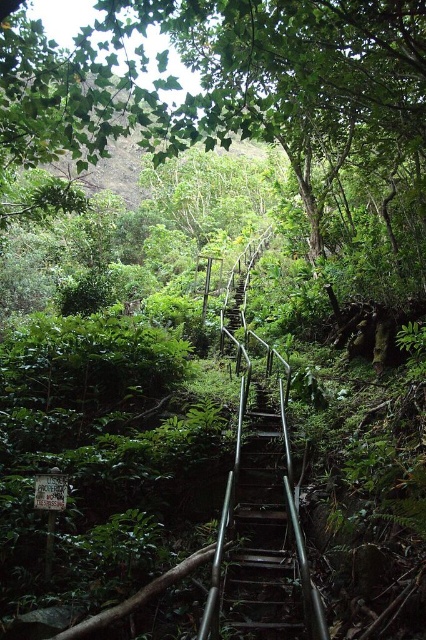
Between green leafy tree at upper center and metallic silver stairs at center, which one has less height?

metallic silver stairs at center

Is green leafy tree at upper center shorter than metallic silver stairs at center?

In fact, green leafy tree at upper center may be taller than metallic silver stairs at center.

Is point (412, 97) closer to viewer compared to point (255, 564)?

No, it is behind (255, 564).

This screenshot has width=426, height=640. Find the location of `green leafy tree at upper center`. green leafy tree at upper center is located at coordinates (256, 76).